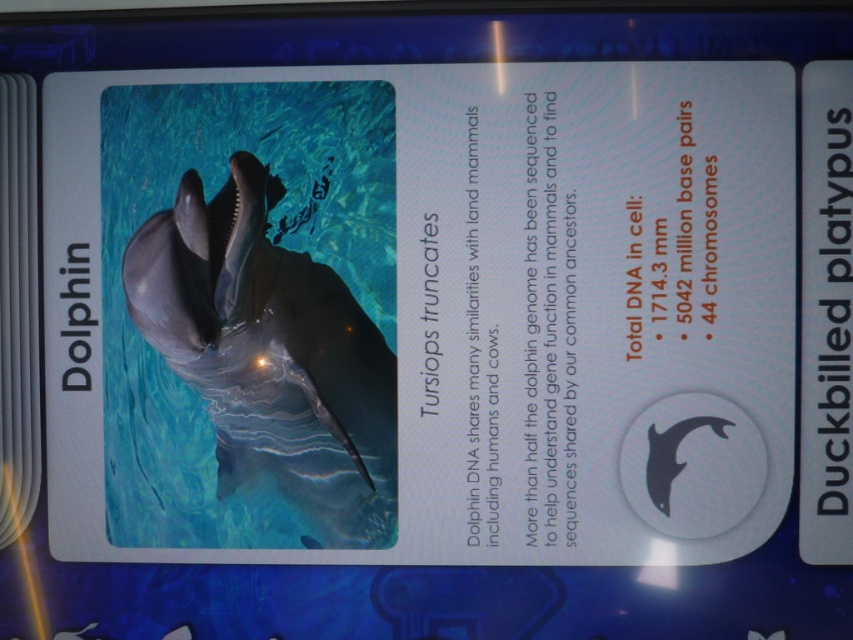
Question: Among these points, which one is nearest to the camera?

Choices:
 (A) (283, 348)
 (B) (654, 460)

Answer: (B)

Question: Can you confirm if shiny gray dolphin at center is smaller than black matte dolphin at lower right?

Choices:
 (A) no
 (B) yes

Answer: (A)

Question: Does shiny gray dolphin at center have a lesser width compared to black matte dolphin at lower right?

Choices:
 (A) yes
 (B) no

Answer: (B)

Question: Observing the image, what is the correct spatial positioning of shiny gray dolphin at center in reference to black matte dolphin at lower right?

Choices:
 (A) right
 (B) left

Answer: (B)

Question: Which of the following is the farthest from the observer?

Choices:
 (A) (666, 458)
 (B) (370, 339)

Answer: (B)